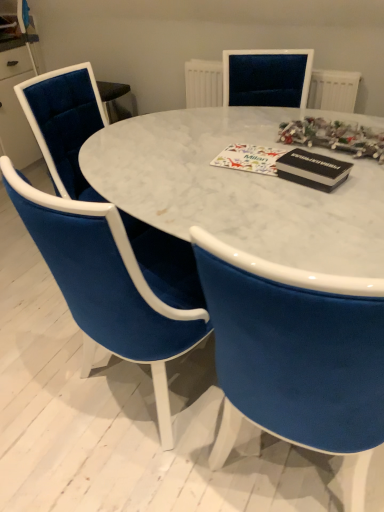
At what (x,y) coordinates should I click in order to perform the action: click on vacant point to the left of black matte magazine at upper right. Please return your answer as a coordinate pair (x, y). Image resolution: width=384 pixels, height=512 pixels. Looking at the image, I should click on (251, 179).